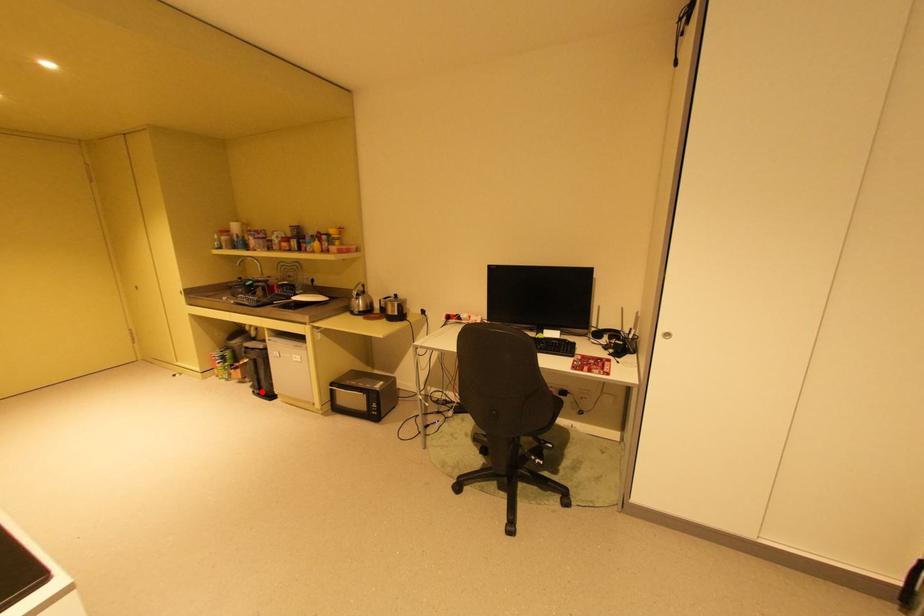
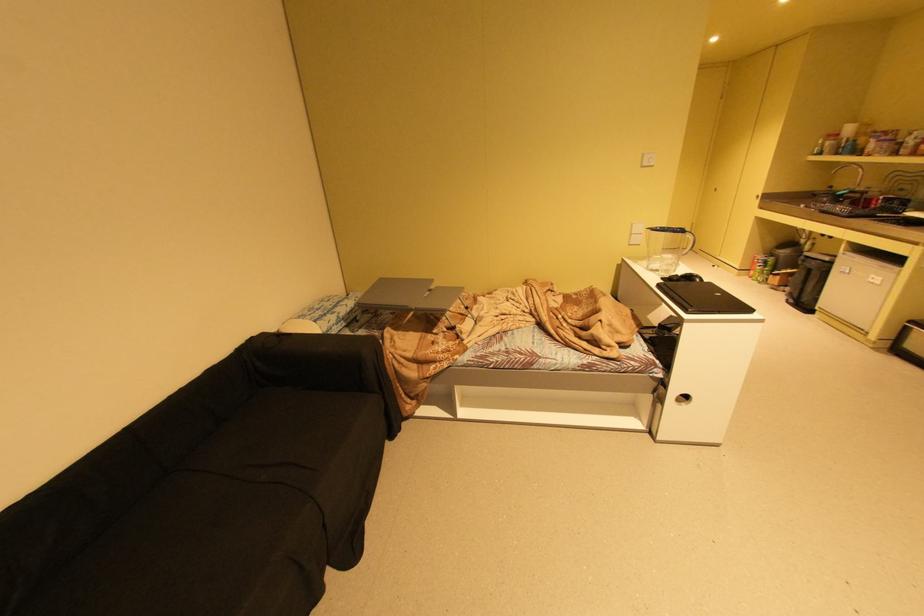
Find the pixel in the second image that matches the highlighted location in the first image.

(796, 301)